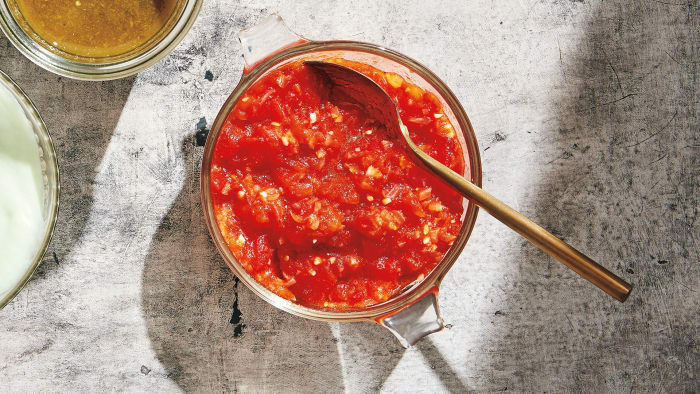
This screenshot has width=700, height=394. In order to click on plate in this screenshot , I will do `click(21, 248)`.